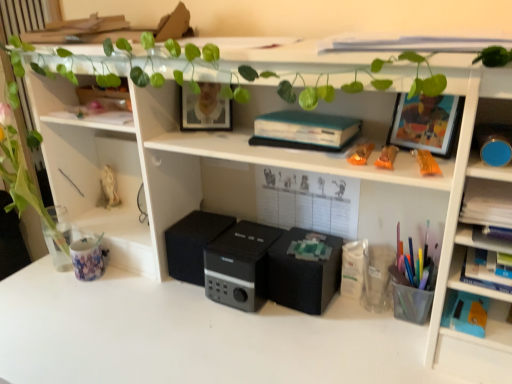
Question: Is translucent plastic cup at right, which is the first stationery in right-to-left order, to the left or to the right of translucent orange pen at upper right, the 2th stationery viewed from the left, in the image?

Choices:
 (A) right
 (B) left

Answer: (A)

Question: From their relative heights in the image, would you say translucent plastic cup at right, positioned as the second stationery in back-to-front order, is taller or shorter than translucent orange pen at upper right, which is the 1th stationery from top to bottom?

Choices:
 (A) tall
 (B) short

Answer: (A)

Question: Considering the real-world distances, which object is farthest from the black matte speaker at center, which is the 2th speaker from left to right?

Choices:
 (A) teal matte book at center
 (B) translucent orange pen at upper right, arranged as the 2th stationery when viewed from the right
 (C) translucent plastic cup at right, which ranks as the third stationery in top-to-bottom order
 (D) matte white statue at left
 (E) black matte speaker at center, the 3th speaker in the left-to-right sequence

Answer: (D)

Question: Considering the real-world distances, which object is closest to the black matte speaker at center, positioned as the first speaker in right-to-left order?

Choices:
 (A) black matte speaker at center, which is the 1th speaker in left-to-right order
 (B) printed ceramic mug at left, arranged as the second stationery when viewed from the top
 (C) translucent orange pen at upper right, which is the 1th stationery from top to bottom
 (D) hardcover book at right
 (E) matte white statue at left

Answer: (A)